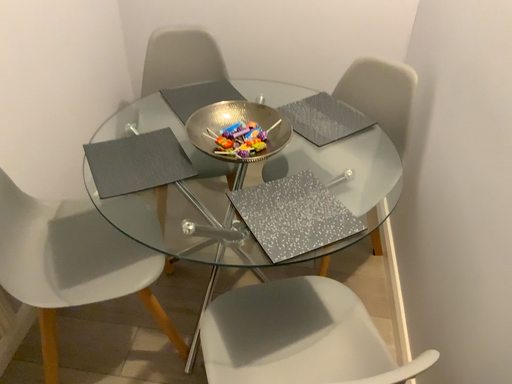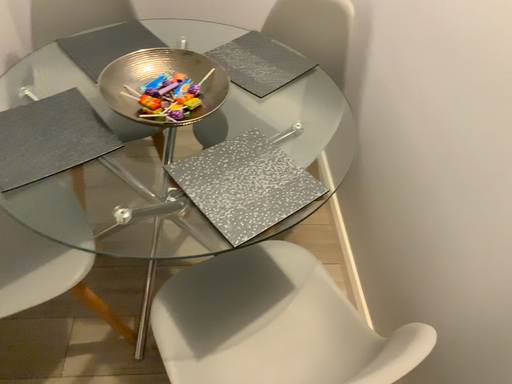
Question: How did the camera likely rotate when shooting the video?

Choices:
 (A) rotated right
 (B) rotated left

Answer: (A)